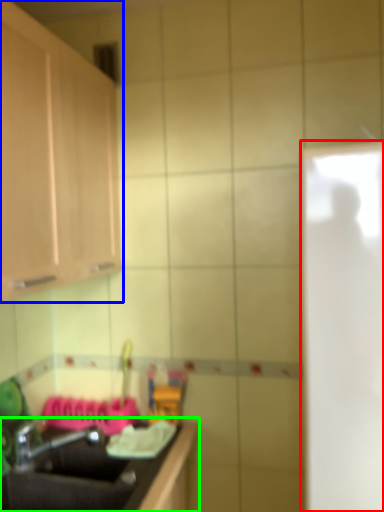
Question: Which object is the farthest from glass door (highlighted by a red box)? Choose among these: cabinetry (highlighted by a blue box) or countertop (highlighted by a green box).

Choices:
 (A) cabinetry
 (B) countertop

Answer: (A)